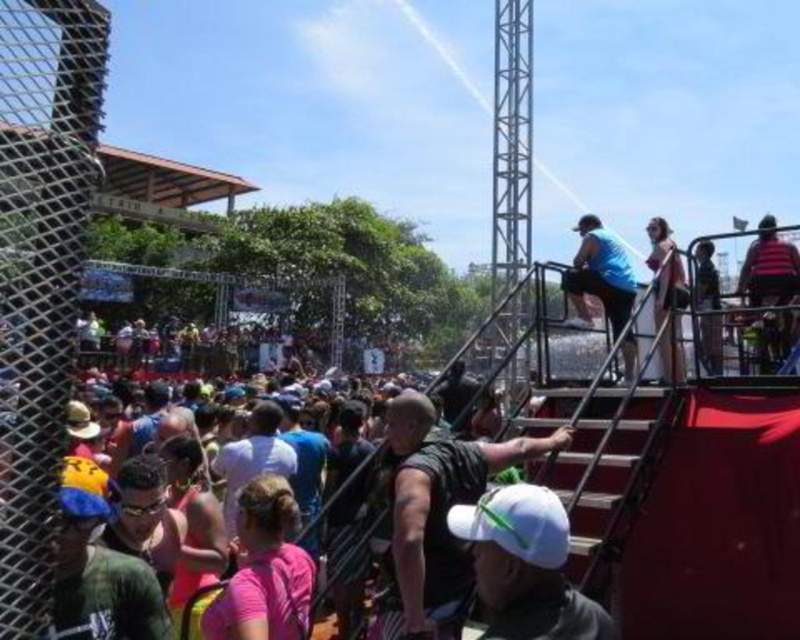
Who is positioned more to the right, black mesh shirt at center or white fabric dress at upper right?

white fabric dress at upper right is more to the right.

Does black mesh shirt at center appear on the right side of white fabric dress at upper right?

Incorrect, black mesh shirt at center is not on the right side of white fabric dress at upper right.

Describe the element at coordinates (436, 518) in the screenshot. Image resolution: width=800 pixels, height=640 pixels. I see `black mesh shirt at center` at that location.

You are a GUI agent. You are given a task and a screenshot of the screen. Output one action in this format:
    pyautogui.click(x=<x>, y=<y>)
    Task: Click on the black mesh shirt at center
    
    Given the screenshot: What is the action you would take?
    point(436,518)

Is pink fabric shirt at center to the left of white fabric dress at upper right from the viewer's perspective?

Yes, pink fabric shirt at center is to the left of white fabric dress at upper right.

Between pink fabric shirt at center and white fabric dress at upper right, which one appears on the left side from the viewer's perspective?

pink fabric shirt at center is more to the left.

Which is behind, point (276, 636) or point (674, 316)?

Point (674, 316)

The image size is (800, 640). Identify the location of pink fabric shirt at center. (264, 570).

Can you confirm if white matte baseball cap at lower center is wider than blue matte shirt at upper right?

Yes.

Is point (516, 552) positioned behind point (633, 364)?

No, (516, 552) is closer to viewer.

This screenshot has height=640, width=800. Identify the location of white matte baseball cap at lower center. (525, 566).